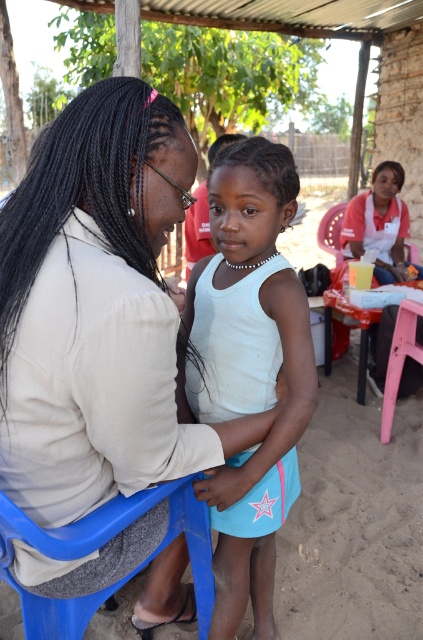
Question: Observing the image, what is the correct spatial positioning of blue plastic chair at lower left in reference to pink plastic picnic table at lower right?

Choices:
 (A) right
 (B) left

Answer: (B)

Question: Estimate the real-world distances between objects in this image. Which object is closer to the pink plastic picnic table at lower right?

Choices:
 (A) white fabric shirt at upper right
 (B) matte beige shirt at center
 (C) white matte tank top at center
 (D) blue plastic chair at lower left

Answer: (A)

Question: Which is nearer to the matte beige shirt at center?

Choices:
 (A) blue plastic chair at lower left
 (B) white matte tank top at center
 (C) pink plastic picnic table at lower right
 (D) white fabric shirt at upper right

Answer: (A)

Question: From the image, what is the correct spatial relationship of white matte tank top at center in relation to white fabric shirt at upper right?

Choices:
 (A) above
 (B) below

Answer: (B)

Question: Estimate the real-world distances between objects in this image. Which object is closer to the white matte tank top at center?

Choices:
 (A) matte beige shirt at center
 (B) blue plastic chair at lower left
 (C) pink plastic picnic table at lower right
 (D) white fabric shirt at upper right

Answer: (B)

Question: Can you confirm if white matte tank top at center is thinner than white fabric shirt at upper right?

Choices:
 (A) yes
 (B) no

Answer: (A)